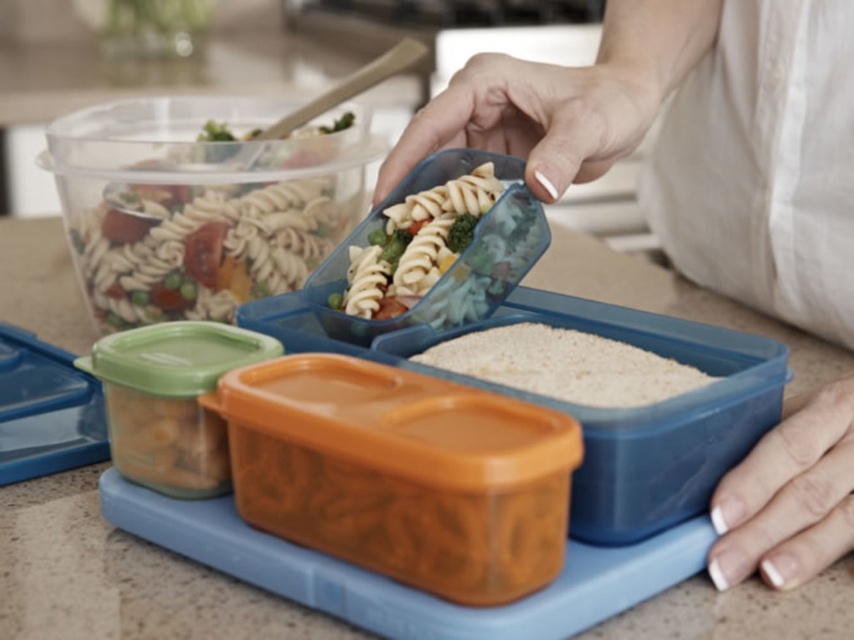
You are packing a lunchbox and see two containers with pasta. The translucent plastic pasta at upper left and the translucent plastic pasta at center are both on your kitchen counter. Which one is positioned more to the left?

The translucent plastic pasta at upper left is positioned more to the left than the translucent plastic pasta at center.

Based on the coordinates provided in the scene description, where exactly is the white matte rice at center located?

The white matte rice at center is located at point coordinates of (564, 365).

You are packing a lunchbox and see the translucent plastic pasta at upper left and the translucent plastic pasta at center. Which one is positioned higher?

The translucent plastic pasta at upper left is positioned higher than the translucent plastic pasta at center.